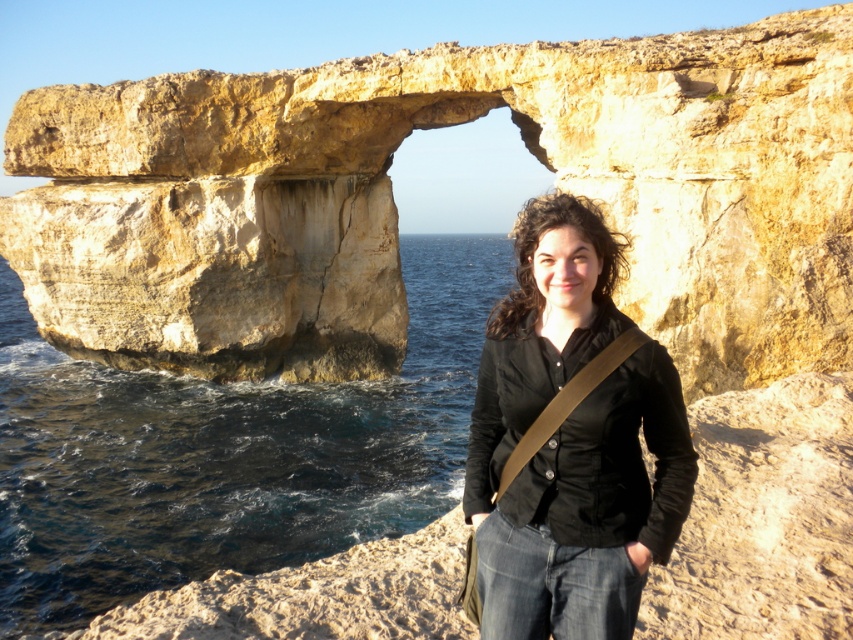
What do you see at coordinates (572, 440) in the screenshot?
I see `matte black shirt at center` at bounding box center [572, 440].

From the picture: Who is more distant from viewer, (662, 368) or (827, 424)?

Positioned behind is point (827, 424).

Where is `matte black shirt at center`? This screenshot has height=640, width=853. matte black shirt at center is located at coordinates (572, 440).

Locate an element on the screen. matte black shirt at center is located at coordinates (572, 440).

Does dark blue water at lower left appear under matte black shirt at center?

Incorrect, dark blue water at lower left is not positioned below matte black shirt at center.

Between point (368, 394) and point (602, 358), which one is positioned in front?

Point (602, 358) is more forward.

Does point (259, 410) lie behind point (581, 212)?

Yes, point (259, 410) is farther from viewer.

Locate an element on the screen. This screenshot has height=640, width=853. dark blue water at lower left is located at coordinates (225, 452).

Does yellowish stone arch at center have a greater height compared to matte black shirt at center?

Yes, yellowish stone arch at center is taller than matte black shirt at center.

Describe the element at coordinates (395, 209) in the screenshot. I see `yellowish stone arch at center` at that location.

Where is `yellowish stone arch at center`? Image resolution: width=853 pixels, height=640 pixels. yellowish stone arch at center is located at coordinates (395, 209).